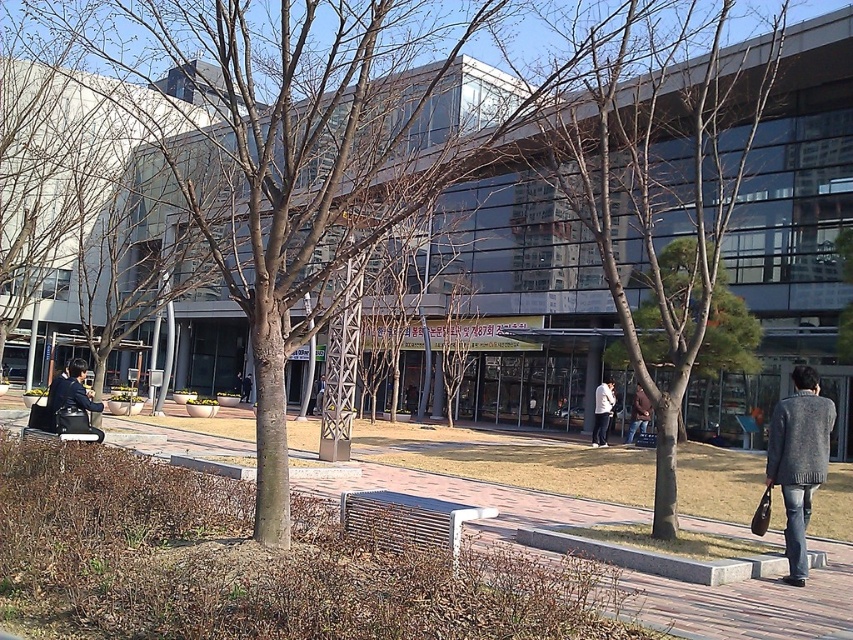
Based on the photo, you are a delivery person with a large box that is 2 meters wide. You need to place it on either the brick pavement at center or the metallic silver bench at center. Based on their widths, which surface can accommodate the box?

The brick pavement at center is wider than the metallic silver bench at center, so the box can be placed on the brick pavement at center.

You are standing in the urban outdoor scene and want to sit down. Which object, the brick pavement at center or the metallic silver bench at center, is closer to you?

The brick pavement at center is closer to you because it is further to the viewer than the metallic silver bench at center.

You are a photographer standing at the edge of the scene. You want to capture both the bare wood tree at center and the white matte jacket at center in the same frame. Based on their positions and sizes, do you think you can fit both objects into your camera view without moving your position?

The bare wood tree at center might be wider than white matte jacket at center, so there is a possibility that the tree could block part of the jacket or require adjusting the camera angle to include both in the frame.